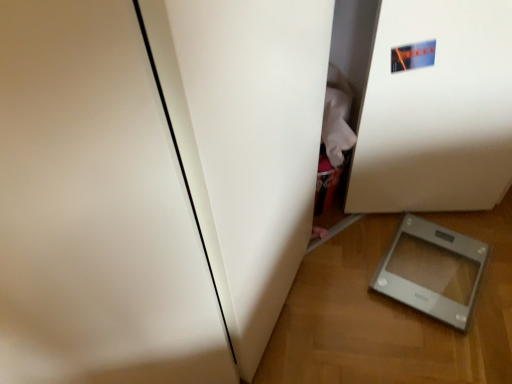
I want to click on free space above silver plastic scale at lower right (from a real-world perspective), so click(x=443, y=244).